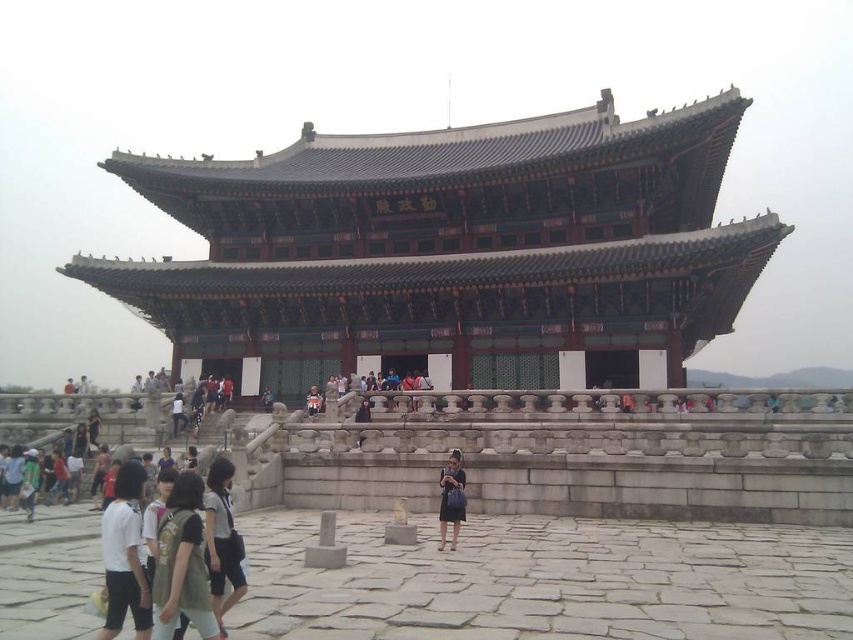
Between point (613, 304) and point (119, 500), which one is positioned in front?

Point (119, 500) is more forward.

Does polished wood palace at center appear over white cotton shirt at lower left?

Correct, polished wood palace at center is located above white cotton shirt at lower left.

Describe the element at coordinates (453, 248) in the screenshot. The height and width of the screenshot is (640, 853). I see `polished wood palace at center` at that location.

Find the location of `polished wood palace at center`. polished wood palace at center is located at coordinates (453, 248).

Can you confirm if white cotton shirt at lower left is taller than light brown leather jacket at center?

Yes, white cotton shirt at lower left is taller than light brown leather jacket at center.

Can you confirm if white cotton shirt at lower left is bigger than light brown leather jacket at center?

Yes.

Is point (108, 609) positioned after point (312, 396)?

No, (108, 609) is in front of (312, 396).

Where is `white cotton shirt at lower left`? white cotton shirt at lower left is located at coordinates (125, 556).

Between polished wood palace at center and matte black dress at center, which one appears on the right side from the viewer's perspective?

polished wood palace at center is more to the right.

Does polished wood palace at center appear on the right side of matte black dress at center?

Correct, you'll find polished wood palace at center to the right of matte black dress at center.

Identify the location of polished wood palace at center. (453, 248).